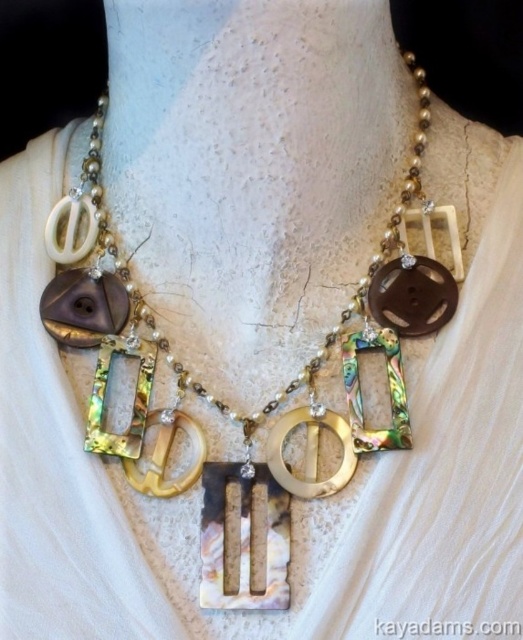
Is shiny abalone shell necklace at center further to camera compared to black pearl letter k at center?

Yes.

Does shiny abalone shell necklace at center have a smaller size compared to black pearl letter k at center?

No, shiny abalone shell necklace at center is not smaller than black pearl letter k at center.

You are a GUI agent. You are given a task and a screenshot of the screen. Output one action in this format:
    pyautogui.click(x=<x>, y=<y>)
    Task: Click on the shiny abalone shell necklace at center
    The width and height of the screenshot is (523, 640).
    Given the screenshot: What is the action you would take?
    pyautogui.click(x=154, y=317)